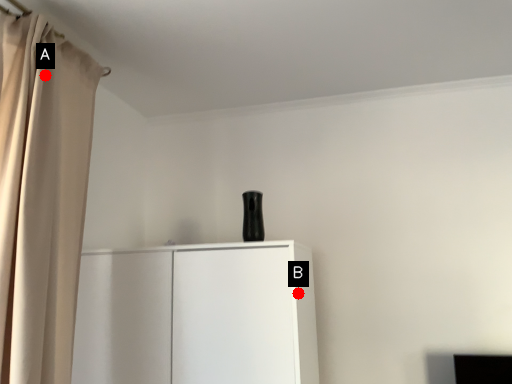
Question: Two points are circled on the image, labeled by A and B beside each circle. Which point is closer to the camera?

Choices:
 (A) A is closer
 (B) B is closer

Answer: (A)